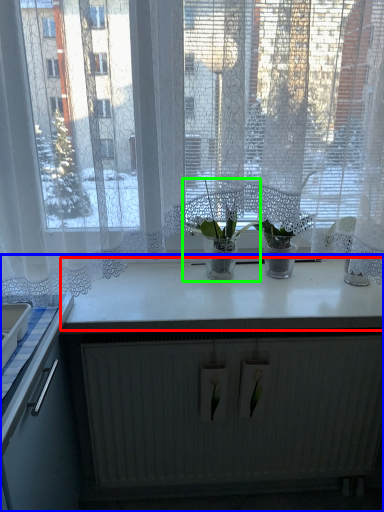
Question: Which is farther away from counter top (highlighted by a red box)? countertop (highlighted by a blue box) or houseplant (highlighted by a green box)?

Choices:
 (A) countertop
 (B) houseplant

Answer: (B)